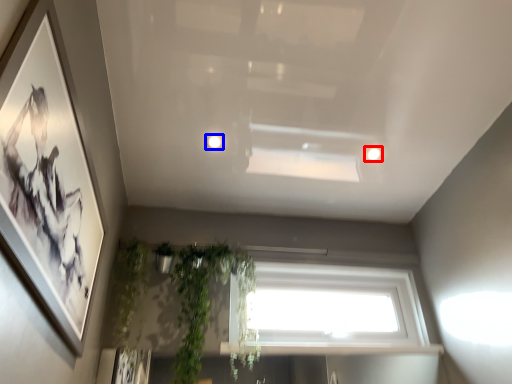
Question: Which object appears farthest to the camera in this image, lighting (highlighted by a red box) or lighting (highlighted by a blue box)?

Choices:
 (A) lighting
 (B) lighting

Answer: (A)